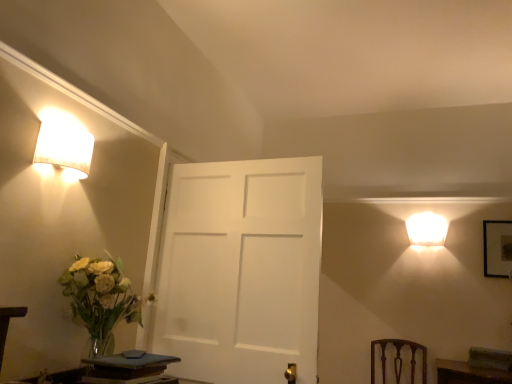
Question: From a real-world perspective, is smooth dark wood table at lower left, the 1th table positioned from the back, physically below wooden table at lower left, marked as the 2th table in a back-to-front arrangement?

Choices:
 (A) no
 (B) yes

Answer: (B)

Question: Can we say smooth dark wood table at lower left, the 1th table positioned from the back, lies outside wooden table at lower left, which is the first table in front-to-back order?

Choices:
 (A) yes
 (B) no

Answer: (A)

Question: Is smooth dark wood table at lower left, the 1th table positioned from the back, shorter than wooden table at lower left, which is the first table in front-to-back order?

Choices:
 (A) no
 (B) yes

Answer: (B)

Question: Is wooden table at lower left, which is the first table in front-to-back order, located within smooth dark wood table at lower left, the first table viewed from the right?

Choices:
 (A) no
 (B) yes

Answer: (A)

Question: Considering the relative positions of smooth dark wood table at lower left, the 2th table viewed from the front, and wooden table at lower left, positioned as the first table in left-to-right order, in the image provided, is smooth dark wood table at lower left, the 2th table viewed from the front, to the left of wooden table at lower left, positioned as the first table in left-to-right order, from the viewer's perspective?

Choices:
 (A) yes
 (B) no

Answer: (B)

Question: Is smooth dark wood table at lower left, the first table viewed from the right, aimed at wooden table at lower left, marked as the 2th table in a back-to-front arrangement?

Choices:
 (A) no
 (B) yes

Answer: (A)

Question: Is white matte lampshade at upper right, which appears as the 1th lamp when ordered from the bottom, positioned behind translucent glass vase at left?

Choices:
 (A) no
 (B) yes

Answer: (B)

Question: Can you confirm if white matte lampshade at upper right, which appears as the 1th lamp when ordered from the bottom, is positioned to the left of translucent glass vase at left?

Choices:
 (A) yes
 (B) no

Answer: (B)

Question: Considering the relative sizes of white matte lampshade at upper right, which appears as the 1th lamp when ordered from the bottom, and translucent glass vase at left in the image provided, is white matte lampshade at upper right, which appears as the 1th lamp when ordered from the bottom, taller than translucent glass vase at left?

Choices:
 (A) no
 (B) yes

Answer: (A)

Question: Considering the relative sizes of white matte lampshade at upper right, the first lamp from the right, and translucent glass vase at left in the image provided, is white matte lampshade at upper right, the first lamp from the right, smaller than translucent glass vase at left?

Choices:
 (A) no
 (B) yes

Answer: (B)

Question: Is white matte lampshade at upper right, which appears as the 1th lamp when ordered from the bottom, oriented towards translucent glass vase at left?

Choices:
 (A) no
 (B) yes

Answer: (A)

Question: Would you consider white matte lampshade at upper right, which ranks as the first lamp in back-to-front order, to be distant from translucent glass vase at left?

Choices:
 (A) yes
 (B) no

Answer: (A)

Question: Is wooden table at lower left, which is the first table in front-to-back order, thinner than matte white lampshade at upper left, which appears as the second lamp when viewed from the back?

Choices:
 (A) yes
 (B) no

Answer: (A)